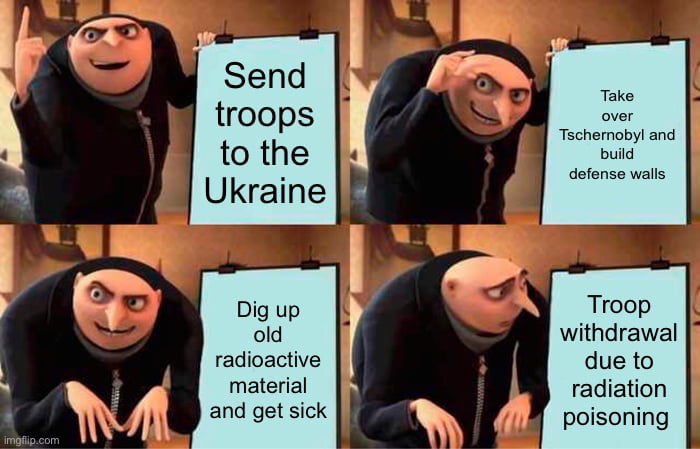
Image resolution: width=700 pixels, height=449 pixels. What are the coordinates of `picture on wall` in the screenshot? It's located at (85, 10), (444, 17), (94, 237), (442, 239).